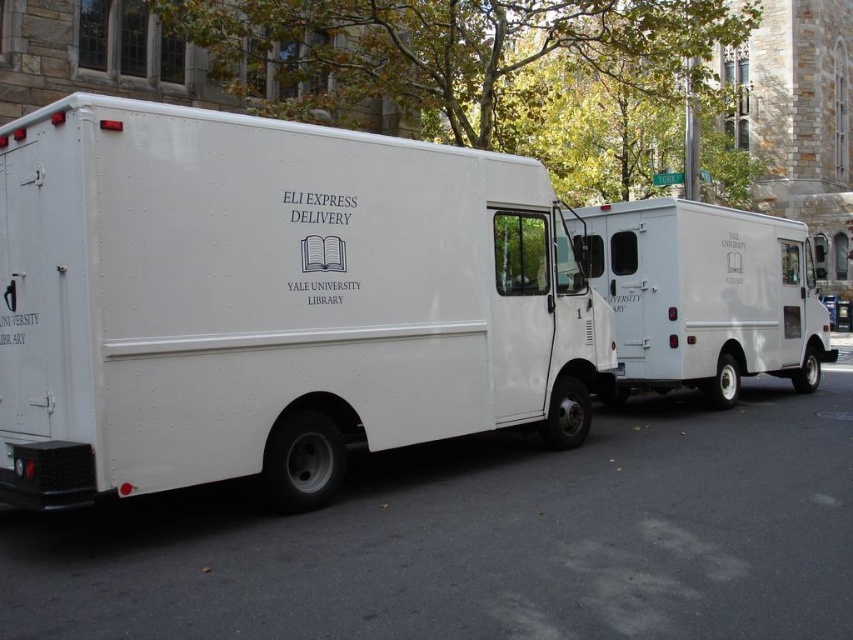
Describe the element at coordinates (270, 301) in the screenshot. Image resolution: width=853 pixels, height=640 pixels. I see `white matte van at center` at that location.

Is point (386, 342) positioned after point (700, 300)?

That is False.

I want to click on white matte van at center, so click(270, 301).